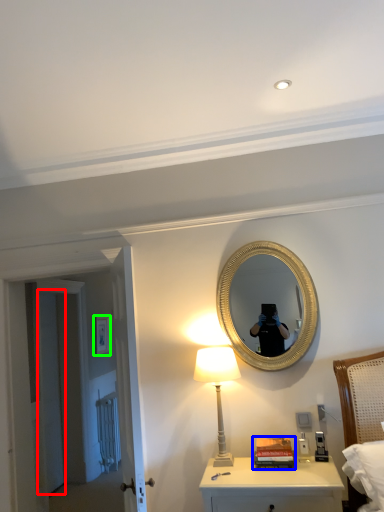
Question: Considering the real-world distances, which object is closest to door (highlighted by a red box)? book (highlighted by a blue box) or picture frame (highlighted by a green box).

Choices:
 (A) book
 (B) picture frame

Answer: (B)